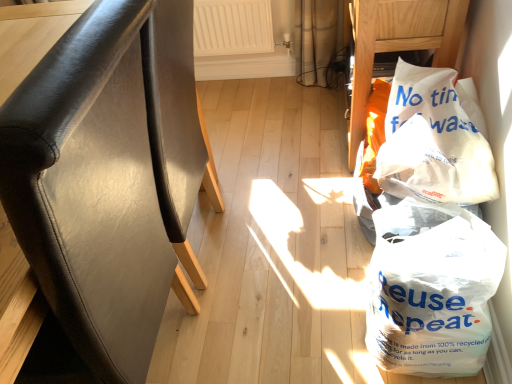
How much space does white paper bag at upper right, the 1th furniture in the right-to-left sequence, occupy horizontally?

white paper bag at upper right, the 1th furniture in the right-to-left sequence, is 39.11 centimeters wide.

Identify the location of white plastic bag at lower right, the 2th plastic bag when ordered from top to bottom. The image size is (512, 384). (431, 289).

From the picture: How much space does white paper bag at right, which appears as the first plastic bag when viewed from the top, occupy vertically?

11.89 inches.

This screenshot has height=384, width=512. Describe the element at coordinates (433, 142) in the screenshot. I see `white paper bag at right, which appears as the first plastic bag when viewed from the top` at that location.

Locate an element on the screen. The image size is (512, 384). white paper bag at upper right, which ranks as the 1th furniture in top-to-bottom order is located at coordinates (400, 43).

Does point (46, 206) lie in front of point (450, 110)?

Yes, it is.

Based on the photo, can we say black leather chair at left, the second furniture from the right, lies outside white paper bag at right, which is the 2th plastic bag in bottom-to-top order?

Yes, black leather chair at left, the second furniture from the right, is outside of white paper bag at right, which is the 2th plastic bag in bottom-to-top order.

From the image's perspective, who appears lower, black leather chair at left, which appears as the first furniture when ordered from the bottom, or white paper bag at right, which appears as the first plastic bag when viewed from the top?

black leather chair at left, which appears as the first furniture when ordered from the bottom, is shown below in the image.

Which of these two, black leather chair at left, arranged as the second furniture when viewed from the back, or white paper bag at right, which appears as the first plastic bag when viewed from the top, stands shorter?

white paper bag at right, which appears as the first plastic bag when viewed from the top, is shorter.

Is white paper bag at right, which is the 2th plastic bag in bottom-to-top order, turned away from black leather chair at left, arranged as the second furniture when viewed from the back?

That's not correct — white paper bag at right, which is the 2th plastic bag in bottom-to-top order, is not looking away from black leather chair at left, arranged as the second furniture when viewed from the back.

Which of these two, white paper bag at right, which is the 2th plastic bag in bottom-to-top order, or black leather chair at left, the 2th furniture viewed from the top, stands shorter?

Standing shorter between the two is white paper bag at right, which is the 2th plastic bag in bottom-to-top order.

Between white paper bag at right, which is the 2th plastic bag in bottom-to-top order, and black leather chair at left, the 1th furniture from the left, which one has smaller size?

white paper bag at right, which is the 2th plastic bag in bottom-to-top order.

Are white paper bag at right, which is the 2th plastic bag in bottom-to-top order, and black leather chair at left, the 1th furniture from the left, making contact?

They are not placed beside each other.

Could white plastic bag at lower right, the 2th plastic bag when ordered from top to bottom, be considered to be inside black leather chair at left, arranged as the second furniture when viewed from the back?

No, black leather chair at left, arranged as the second furniture when viewed from the back, does not contain white plastic bag at lower right, the 2th plastic bag when ordered from top to bottom.

From the image's perspective, is black leather chair at left, which is the first furniture in front-to-back order, on white plastic bag at lower right, marked as the 1th plastic bag in a bottom-to-top arrangement?

Yes.

Considering the relative sizes of black leather chair at left, the second furniture from the right, and white plastic bag at lower right, marked as the 1th plastic bag in a bottom-to-top arrangement, in the image provided, is black leather chair at left, the second furniture from the right, wider than white plastic bag at lower right, marked as the 1th plastic bag in a bottom-to-top arrangement,?

Correct, the width of black leather chair at left, the second furniture from the right, exceeds that of white plastic bag at lower right, marked as the 1th plastic bag in a bottom-to-top arrangement.

From the image's perspective, who appears lower, white paper bag at upper right, arranged as the 2th furniture when ordered from the bottom, or white plastic bag at lower right, the 2th plastic bag when ordered from top to bottom?

From the image's view, white plastic bag at lower right, the 2th plastic bag when ordered from top to bottom, is below.

From a real-world perspective, starting from the white plastic bag at lower right, marked as the 1th plastic bag in a bottom-to-top arrangement, which furniture is the 1st one vertically above it? Please provide its 2D coordinates.

[(400, 43)]

Considering the relative positions of white paper bag at upper right, arranged as the 2th furniture when ordered from the bottom, and white plastic bag at lower right, the 2th plastic bag when ordered from top to bottom, in the image provided, is white paper bag at upper right, arranged as the 2th furniture when ordered from the bottom, behind white plastic bag at lower right, the 2th plastic bag when ordered from top to bottom,?

Yes.

Looking at the image, does white paper bag at upper right, which is the 2th furniture in left-to-right order, seem bigger or smaller compared to white plastic bag at lower right, the 2th plastic bag when ordered from top to bottom?

white paper bag at upper right, which is the 2th furniture in left-to-right order, is bigger than white plastic bag at lower right, the 2th plastic bag when ordered from top to bottom.

Which of these two, black leather chair at left, the second furniture from the right, or white paper bag at upper right, the 1th furniture in the right-to-left sequence, stands taller?

Standing taller between the two is black leather chair at left, the second furniture from the right.

Between black leather chair at left, the 1th furniture from the left, and white paper bag at upper right, arranged as the 2th furniture when ordered from the bottom, which one is positioned in front?

Positioned in front is black leather chair at left, the 1th furniture from the left.

From the image's perspective, which one is positioned higher, black leather chair at left, which is the first furniture in front-to-back order, or white paper bag at upper right, which is the second furniture in front-to-back order?

white paper bag at upper right, which is the second furniture in front-to-back order, is shown above in the image.

The width and height of the screenshot is (512, 384). In order to click on furniture above the white paper bag at upper right, which is the second furniture in front-to-back order (from a real-world perspective) in this screenshot , I will do `click(110, 177)`.

From a real-world perspective, is white paper bag at upper right, the 1th furniture in the right-to-left sequence, positioned above or below white paper bag at right, which is the 2th plastic bag in bottom-to-top order?

white paper bag at upper right, the 1th furniture in the right-to-left sequence, is situated lower than white paper bag at right, which is the 2th plastic bag in bottom-to-top order, in the real world.

Which object is closer to the camera taking this photo, white paper bag at upper right, placed as the 1th furniture when sorted from back to front, or white paper bag at right, which is the 2th plastic bag in bottom-to-top order?

white paper bag at right, which is the 2th plastic bag in bottom-to-top order.

Which of these two, white paper bag at upper right, placed as the 1th furniture when sorted from back to front, or white paper bag at right, which appears as the first plastic bag when viewed from the top, is thinner?

With smaller width is white paper bag at right, which appears as the first plastic bag when viewed from the top.

Which point is more forward, (361,103) or (417,160)?

The point (417,160) is more forward.

From a real-world perspective, is white paper bag at right, which is the 2th plastic bag in bottom-to-top order, located higher than white plastic bag at lower right, the 2th plastic bag when ordered from top to bottom?

Yes, from a real-world perspective, white paper bag at right, which is the 2th plastic bag in bottom-to-top order, is over white plastic bag at lower right, the 2th plastic bag when ordered from top to bottom

Based on their sizes in the image, would you say white paper bag at right, which is the 2th plastic bag in bottom-to-top order, is bigger or smaller than white plastic bag at lower right, the 2th plastic bag when ordered from top to bottom?

white paper bag at right, which is the 2th plastic bag in bottom-to-top order, is smaller than white plastic bag at lower right, the 2th plastic bag when ordered from top to bottom.

Which is in front, point (426, 196) or point (439, 227)?

Point (439, 227)

Which object is positioned more to the right, white paper bag at right, which is the 2th plastic bag in bottom-to-top order, or white plastic bag at lower right, marked as the 1th plastic bag in a bottom-to-top arrangement?

white paper bag at right, which is the 2th plastic bag in bottom-to-top order, is more to the right.

This screenshot has height=384, width=512. I want to click on the 1st plastic bag below the black leather chair at left, arranged as the second furniture when viewed from the back (from a real-world perspective), so click(433, 142).

In order to click on furniture located above the white paper bag at right, which appears as the first plastic bag when viewed from the top (from a real-world perspective) in this screenshot , I will do `click(110, 177)`.

Based on their spatial positions, is white paper bag at right, which is the 2th plastic bag in bottom-to-top order, or white paper bag at upper right, arranged as the 2th furniture when ordered from the bottom, closer to white plastic bag at lower right, marked as the 1th plastic bag in a bottom-to-top arrangement?

white paper bag at right, which is the 2th plastic bag in bottom-to-top order, lies closer to white plastic bag at lower right, marked as the 1th plastic bag in a bottom-to-top arrangement, than the other object.

When comparing their distances from black leather chair at left, which is the first furniture in front-to-back order, does white plastic bag at lower right, marked as the 1th plastic bag in a bottom-to-top arrangement, or white paper bag at right, which is the 2th plastic bag in bottom-to-top order, seem further?

white paper bag at right, which is the 2th plastic bag in bottom-to-top order, is positioned further to the anchor black leather chair at left, which is the first furniture in front-to-back order.

From the image, which object appears to be farther from white paper bag at upper right, arranged as the 2th furniture when ordered from the bottom, black leather chair at left, which appears as the first furniture when ordered from the bottom, or white plastic bag at lower right, marked as the 1th plastic bag in a bottom-to-top arrangement?

black leather chair at left, which appears as the first furniture when ordered from the bottom, lies further to white paper bag at upper right, arranged as the 2th furniture when ordered from the bottom, than the other object.

When comparing their distances from white paper bag at right, which appears as the first plastic bag when viewed from the top, does black leather chair at left, which is the first furniture in front-to-back order, or white paper bag at upper right, which ranks as the 1th furniture in top-to-bottom order, seem closer?

white paper bag at upper right, which ranks as the 1th furniture in top-to-bottom order, lies closer to white paper bag at right, which appears as the first plastic bag when viewed from the top, than the other object.

Looking at the image, which one is located further to white paper bag at right, which appears as the first plastic bag when viewed from the top, white plastic bag at lower right, marked as the 1th plastic bag in a bottom-to-top arrangement, or white paper bag at upper right, which is the second furniture in front-to-back order?

white paper bag at upper right, which is the second furniture in front-to-back order, is further to white paper bag at right, which appears as the first plastic bag when viewed from the top.

From the image, which object appears to be farther from white plastic bag at lower right, marked as the 1th plastic bag in a bottom-to-top arrangement, white paper bag at upper right, the 1th furniture in the right-to-left sequence, or white paper bag at right, which is the 2th plastic bag in bottom-to-top order?

white paper bag at upper right, the 1th furniture in the right-to-left sequence.

Considering their positions, is white paper bag at upper right, the 1th furniture in the right-to-left sequence, positioned closer to white paper bag at right, which is the 2th plastic bag in bottom-to-top order, than black leather chair at left, the 1th furniture from the left?

white paper bag at upper right, the 1th furniture in the right-to-left sequence, is closer to white paper bag at right, which is the 2th plastic bag in bottom-to-top order.

From the image, which object appears to be farther from white paper bag at upper right, placed as the 1th furniture when sorted from back to front, white plastic bag at lower right, the 2th plastic bag when ordered from top to bottom, or black leather chair at left, the 1th furniture from the left?

Among the two, black leather chair at left, the 1th furniture from the left, is located further to white paper bag at upper right, placed as the 1th furniture when sorted from back to front.

You are a GUI agent. You are given a task and a screenshot of the screen. Output one action in this format:
    pyautogui.click(x=<x>, y=<y>)
    Task: Click on the plastic bag between white paper bag at upper right, the 1th furniture in the right-to-left sequence, and white plastic bag at lower right, the 2th plastic bag when ordered from top to bottom, in the vertical direction
    This screenshot has height=384, width=512.
    Given the screenshot: What is the action you would take?
    pyautogui.click(x=433, y=142)

Image resolution: width=512 pixels, height=384 pixels. In order to click on furniture between white paper bag at upper right, placed as the 1th furniture when sorted from back to front, and white plastic bag at lower right, marked as the 1th plastic bag in a bottom-to-top arrangement, from top to bottom in this screenshot , I will do `click(110, 177)`.

This screenshot has height=384, width=512. I want to click on plastic bag between black leather chair at left, arranged as the second furniture when viewed from the back, and white paper bag at right, which appears as the first plastic bag when viewed from the top, from left to right, so click(x=431, y=289).